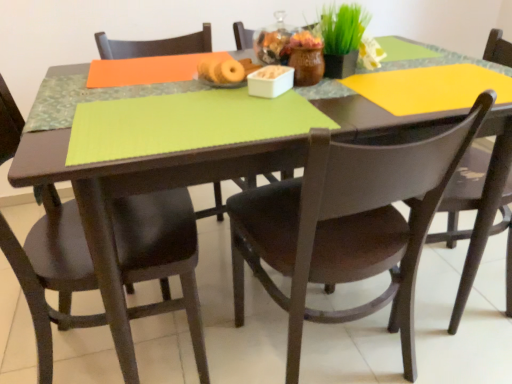
Identify the location of free space in front of green matte plant at upper center. Image resolution: width=512 pixels, height=384 pixels. (342, 96).